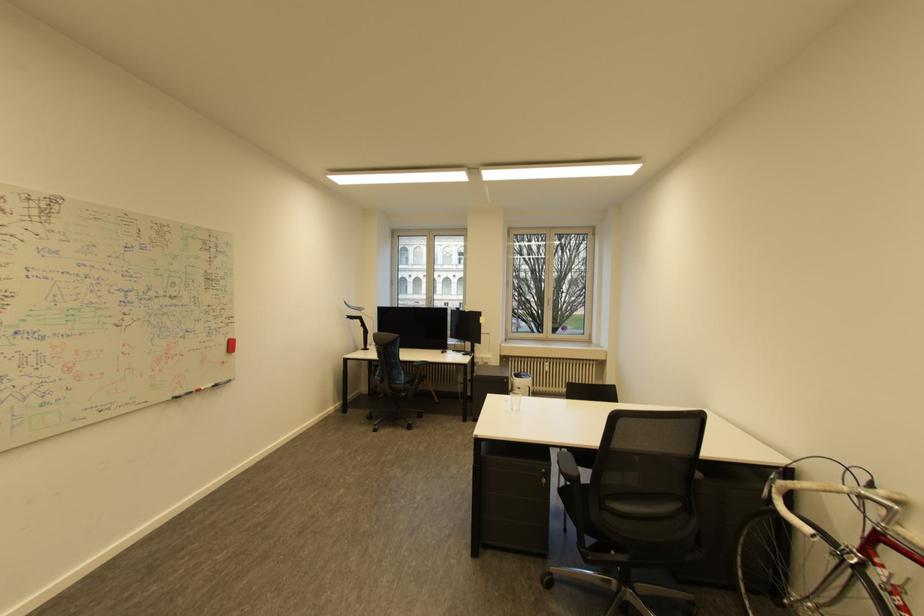
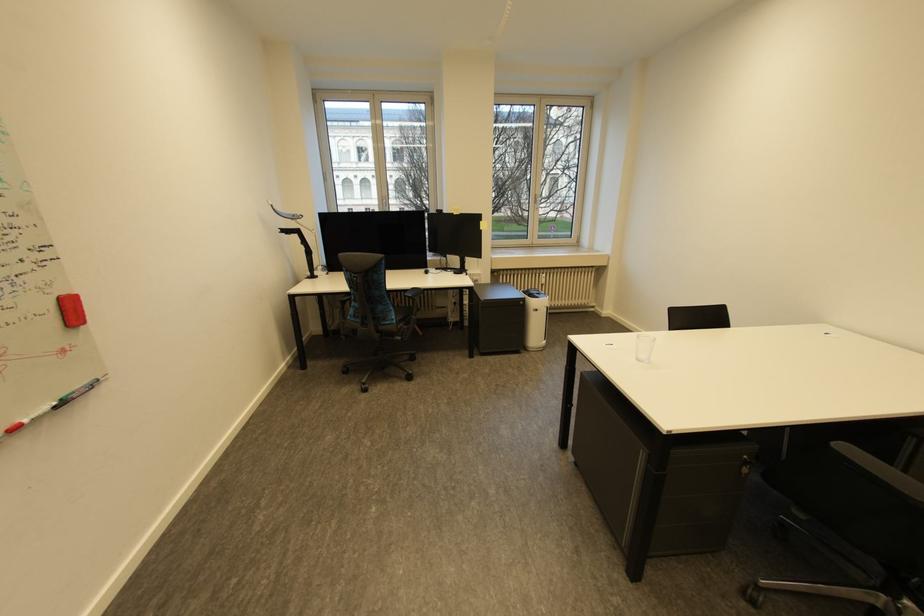
Find the pixel in the second image that matches (546,586) in the first image.

(750, 604)